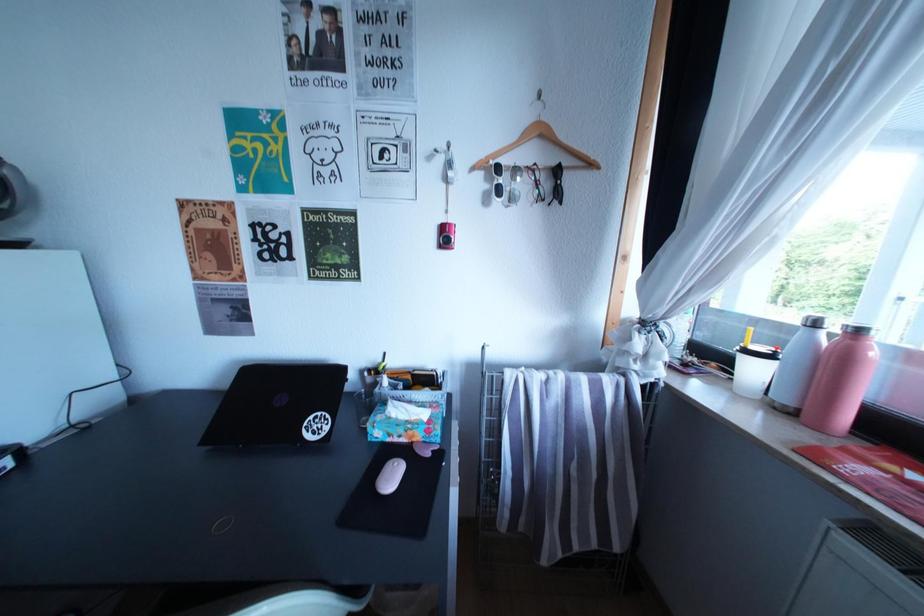
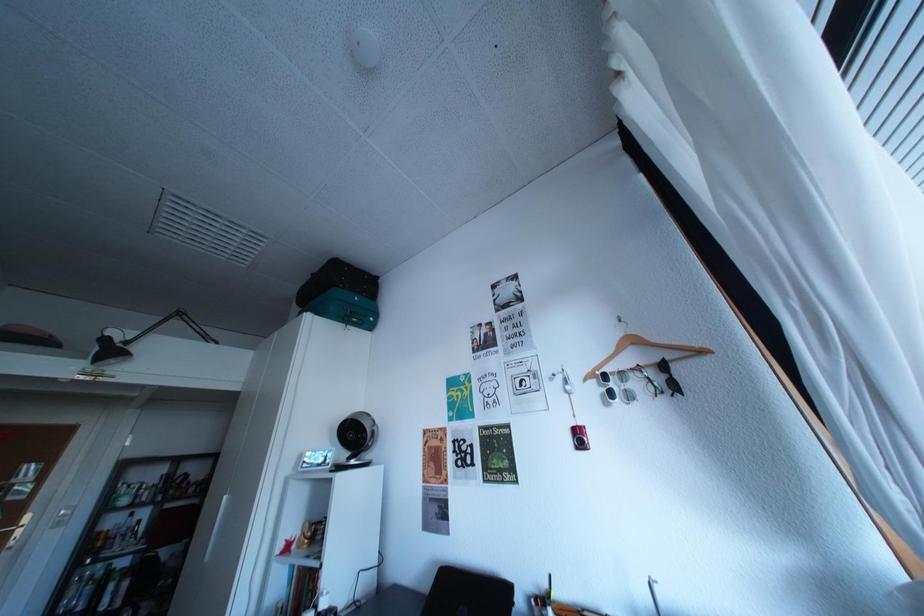
In the scene shown: The first image is from the beginning of the video and the second image is from the end. How did the camera likely rotate when shooting the video?

The rotation direction of the camera is left-up.